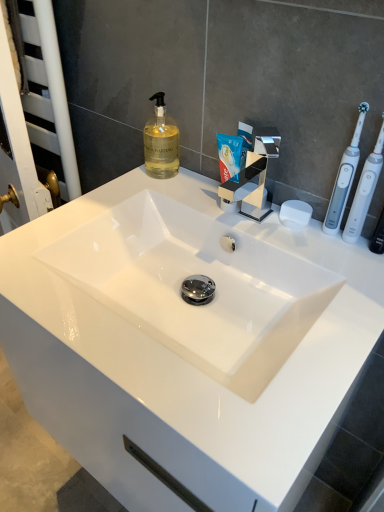
Locate an element on the screen. The height and width of the screenshot is (512, 384). vacant area that lies to the right of chrome metallic tap at center is located at coordinates (313, 246).